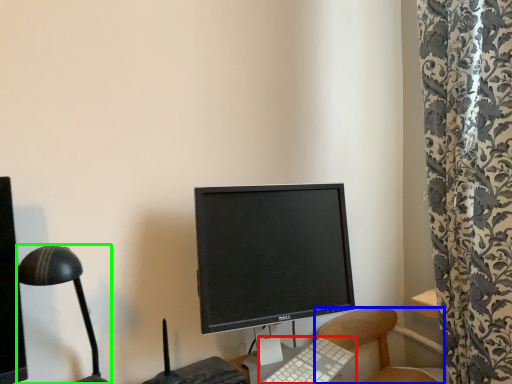
Question: Considering the real-world distances, which object is farthest from computer keyboard (highlighted by a red box)? chair (highlighted by a blue box) or lamp (highlighted by a green box)?

Choices:
 (A) chair
 (B) lamp

Answer: (B)